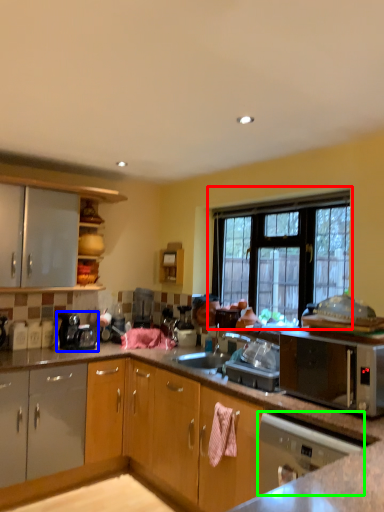
Question: Which object is the farthest from window (highlighted by a red box)? Choose among these: coffee machine (highlighted by a blue box) or home appliance (highlighted by a green box).

Choices:
 (A) coffee machine
 (B) home appliance

Answer: (A)